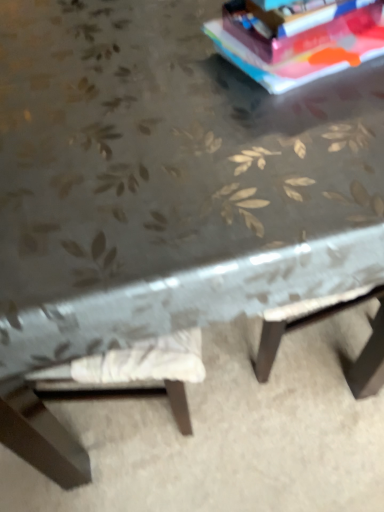
This screenshot has height=512, width=384. Find the location of `free space above white fabric cushion at lower left (from a real-world perspective)`. free space above white fabric cushion at lower left (from a real-world perspective) is located at coordinates (226, 430).